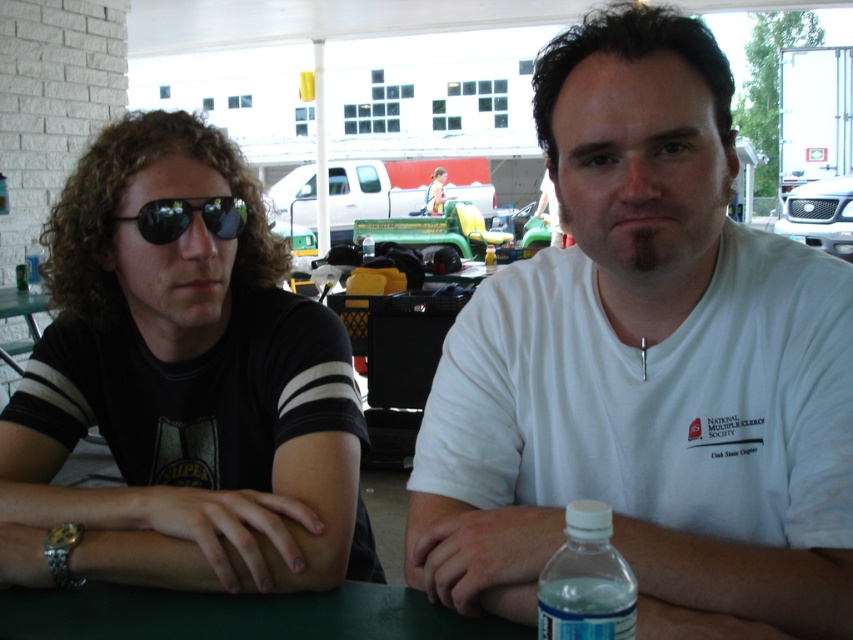
Question: Among these objects, which one is nearest to the camera?

Choices:
 (A) clear plastic bottle at lower center
 (B) green matte table at center

Answer: (A)

Question: Does white cotton shirt at center have a larger size compared to matte black t-shirt at left?

Choices:
 (A) yes
 (B) no

Answer: (B)

Question: Which of these objects is positioned farthest from the matte black t-shirt at left?

Choices:
 (A) clear plastic bottle at lower center
 (B) green matte table at center

Answer: (A)

Question: Which point is closer to the camera?

Choices:
 (A) matte yellow toy car at center
 (B) white cotton shirt at center
 (C) matte black t-shirt at left

Answer: (B)

Question: Can you confirm if sunglasses at left is positioned below matte yellow toy car at center?

Choices:
 (A) no
 (B) yes

Answer: (B)

Question: From the image, what is the correct spatial relationship of sunglasses at left in relation to matte yellow toy car at center?

Choices:
 (A) left
 (B) right

Answer: (A)